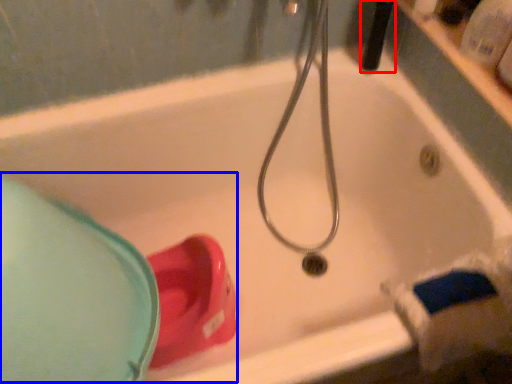
Question: Which point is closer to the camera, shower (highlighted by a red box) or sink (highlighted by a blue box)?

Choices:
 (A) shower
 (B) sink

Answer: (B)